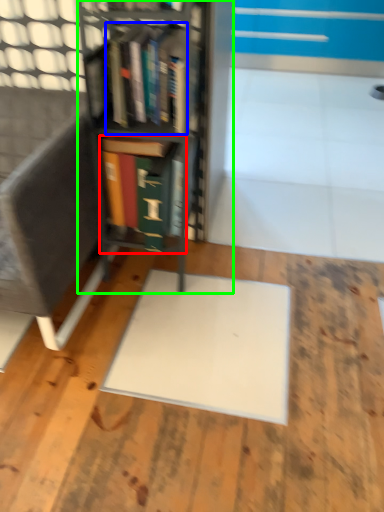
Question: Considering the real-world distances, which object is closest to book (highlighted by a red box)? book (highlighted by a blue box) or bookcase (highlighted by a green box).

Choices:
 (A) book
 (B) bookcase

Answer: (B)